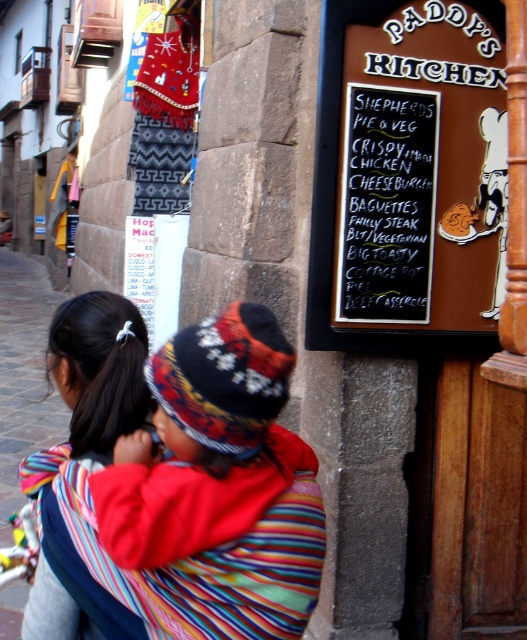
Find the location of a particular element. The image size is (527, 640). multicolored woven fabric at center is located at coordinates (100, 371).

Which of these two, multicolored woven fabric at center or brown chalkboard at upper right, stands shorter?

multicolored woven fabric at center is shorter.

Is point (134, 397) farther from camera compared to point (402, 339)?

That is False.

Locate an element on the screen. The height and width of the screenshot is (640, 527). multicolored woven fabric at center is located at coordinates (100, 371).

Find the location of a particular element. This screenshot has height=640, width=527. multicolored woven cloth at center is located at coordinates (194, 499).

Does point (266, 394) lie behind point (138, 420)?

No, (266, 394) is in front of (138, 420).

The height and width of the screenshot is (640, 527). Identify the location of multicolored woven cloth at center. (194, 499).

In the scene shown: Can you confirm if multicolored woven cloth at center is wider than brown chalkboard at upper right?

No.

Is point (231, 426) positioned after point (355, 22)?

No.

The width and height of the screenshot is (527, 640). I want to click on multicolored woven cloth at center, so click(x=194, y=499).

Find the location of `multicolored woven cloth at center`. multicolored woven cloth at center is located at coordinates [x=194, y=499].